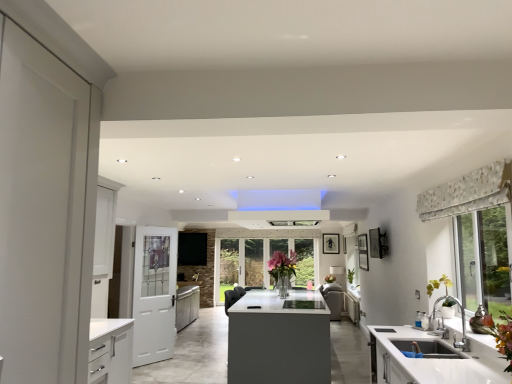
Question: Considering the positions of green matte plant at right and white glossy cabinet at center in the image, is green matte plant at right taller or shorter than white glossy cabinet at center?

Choices:
 (A) tall
 (B) short

Answer: (B)

Question: From the image's perspective, is green matte plant at right above or below white glossy cabinet at center?

Choices:
 (A) above
 (B) below

Answer: (A)

Question: Which is farther from the white matte door at left?

Choices:
 (A) patterned fabric valance at upper right
 (B) clear glass vase at center
 (C) green matte plant at right
 (D) white glossy sink at lower right
 (E) white glossy cabinet at center

Answer: (A)

Question: Based on their relative distances, which object is farther from the white glossy sink at lower right?

Choices:
 (A) white glossy cabinet at center
 (B) clear glass vase at center
 (C) white matte door at left
 (D) green matte plant at right
 (E) patterned fabric valance at upper right

Answer: (B)